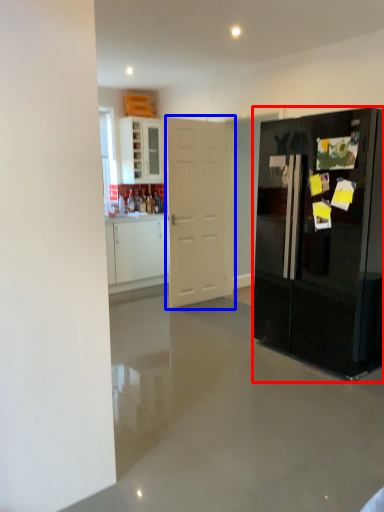
Question: Which point is further to the camera, refrigerator (highlighted by a red box) or door (highlighted by a blue box)?

Choices:
 (A) refrigerator
 (B) door

Answer: (B)